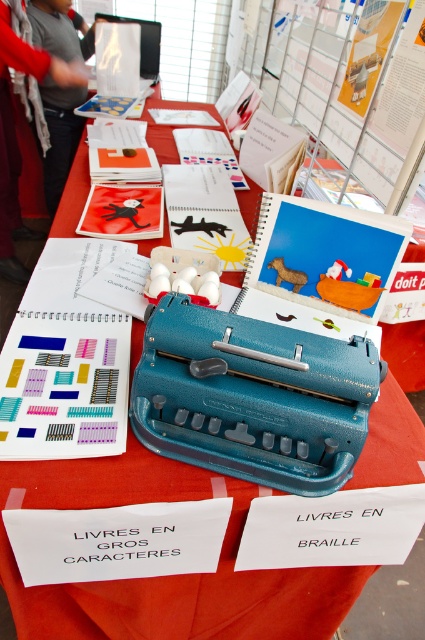
Question: Is teal plastic typewriter at center closer to camera compared to gray fabric jacket at upper left?

Choices:
 (A) yes
 (B) no

Answer: (A)

Question: Where is teal plastic typewriter at center located in relation to gray fabric jacket at upper left in the image?

Choices:
 (A) right
 (B) left

Answer: (A)

Question: Among these points, which one is farthest from the camera?

Choices:
 (A) (71, 44)
 (B) (2, 38)
 (C) (316, 342)

Answer: (A)

Question: Which point is closer to the camera?

Choices:
 (A) gray fabric jacket at upper left
 (B) gray sweater at upper left

Answer: (A)

Question: Which point appears closest to the camera in this image?

Choices:
 (A) (360, 419)
 (B) (53, 168)

Answer: (A)

Question: Does teal plastic typewriter at center appear over gray sweater at upper left?

Choices:
 (A) no
 (B) yes

Answer: (A)